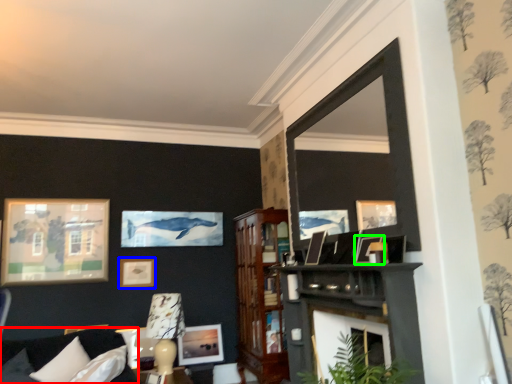
Question: Estimate the real-world distances between objects in this image. Which object is closer to couch (highlighted by a red box), picture frame (highlighted by a blue box) or picture frame (highlighted by a green box)?

Choices:
 (A) picture frame
 (B) picture frame

Answer: (A)